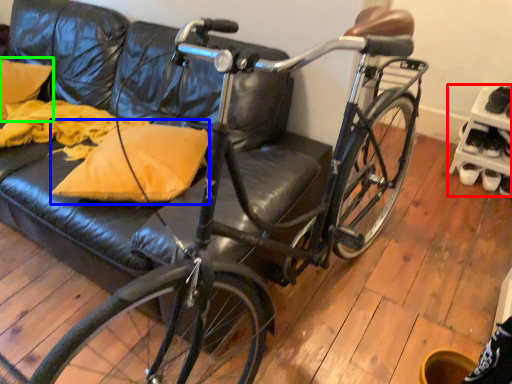
Question: Which is farther away from shelf (highlighted by a red box)? throw pillow (highlighted by a blue box) or pillow (highlighted by a green box)?

Choices:
 (A) throw pillow
 (B) pillow

Answer: (B)